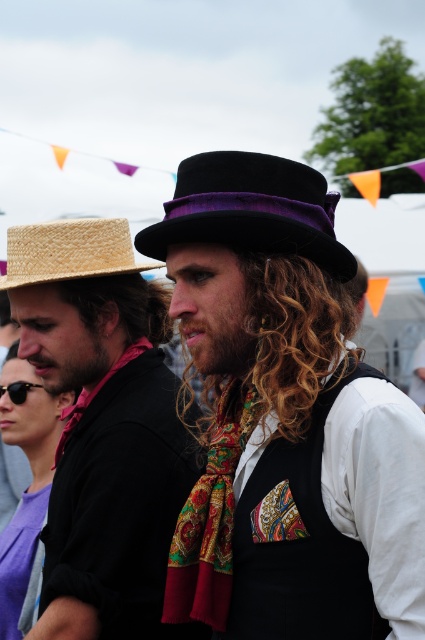
Question: Among these objects, which one is nearest to the camera?

Choices:
 (A) curly golden hair at center
 (B) straw fedora at upper left
 (C) velvet black fedora at center
 (D) matte straw hat at left

Answer: (A)

Question: Is velvet purple top hat at center in front of velvet black fedora at center?

Choices:
 (A) yes
 (B) no

Answer: (A)

Question: Which is farther from the curly golden hair at center?

Choices:
 (A) velvet black fedora at center
 (B) straw fedora at upper left
 (C) black velvet vest at center

Answer: (B)

Question: Which object is the closest to the straw fedora at upper left?

Choices:
 (A) matte straw hat at left
 (B) velvet purple top hat at center
 (C) multicolored patterned scarf at center

Answer: (A)

Question: Considering the relative positions of black velvet vest at center and curly golden hair at center in the image provided, where is black velvet vest at center located with respect to curly golden hair at center?

Choices:
 (A) above
 (B) below

Answer: (B)

Question: Is curly golden hair at center further to the viewer compared to straw fedora at upper left?

Choices:
 (A) yes
 (B) no

Answer: (B)